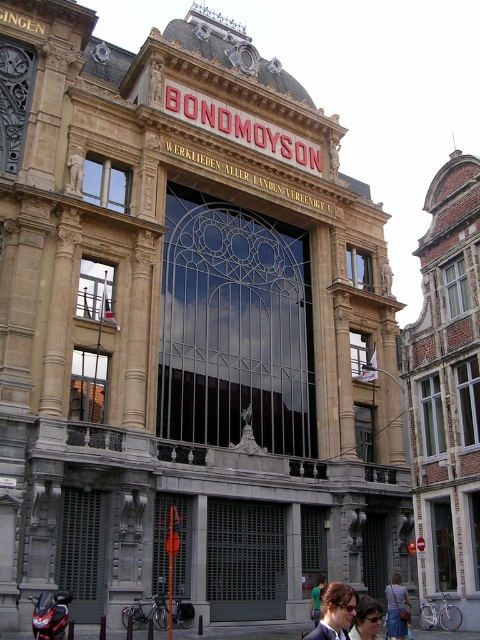
You are a photographer taking a picture of the building with the sign reading BONDOMOYSON. You notice two features on the person in the foreground. What is the position of the dark brown hair at center relative to the matte black sunglasses at lower center?

The dark brown hair at center is located above the matte black sunglasses at lower center.

You are a tailor who needs to determine which item to adjust first, the denim jacket at lower right or the matte black sunglasses at lower center, based on their widths. Which item requires more space on the worktable due to its larger width?

The matte black sunglasses at lower center requires more space on the worktable because its width is greater than the denim jacket at lower right.

You are a fashion designer observing the scene. You see the denim jacket at lower right and the matte black sunglasses at lower center. Which item is shorter in height?

The denim jacket at lower right is shorter than the matte black sunglasses at lower center.